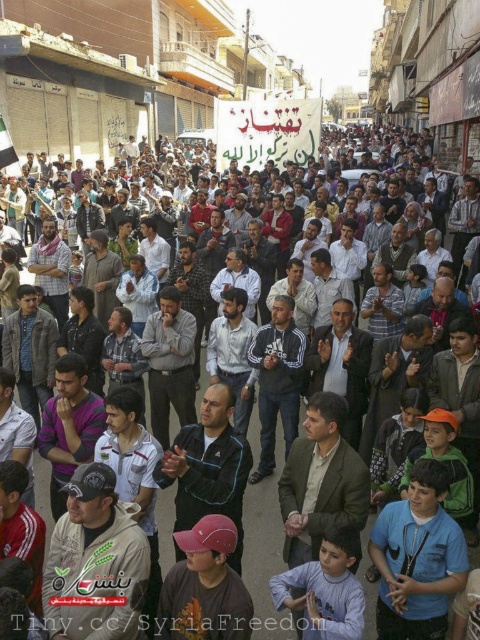
You are a photographer trying to capture a clear shot of the dark gray cap at center and the blue fabric shirt at lower right. Since the crowd is very dense, you need to adjust your camera angle. Which object should you focus on first to ensure both are in frame?

The dark gray cap at center is located above the blue fabric shirt at lower right, so you should focus on the dark gray cap at center first to ensure both are in frame.

You are a photographer trying to capture a clear shot of the dark gray cap at center and the blue fabric shirt at lower right. Based on their widths, which object might block the other when framing the shot?

The dark gray cap at center might be wider than the blue fabric shirt at lower right, so it could potentially block the view of the blue fabric shirt at lower right when framing the shot.

You are a photographer standing at the origin point of the image. You want to capture a photo of the dark gray cap at center located at point (96, 563). What direction should you move to get closer to the dark gray cap at center?

The dark gray cap at center is located at point (96, 563). Since the photographer is at the origin point, they should move towards the coordinates (96, 563) to get closer to the dark gray cap at center.